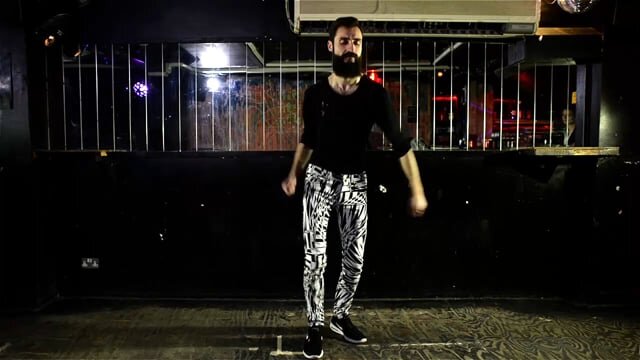
I want to click on red neon light, so click(440, 95).